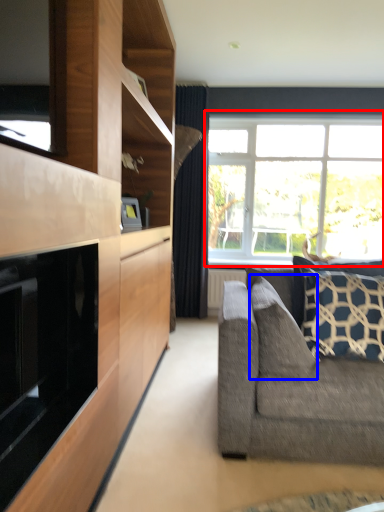
Question: Which of the following is the closest to the observer, window (highlighted by a red box) or pillow (highlighted by a blue box)?

Choices:
 (A) window
 (B) pillow

Answer: (B)